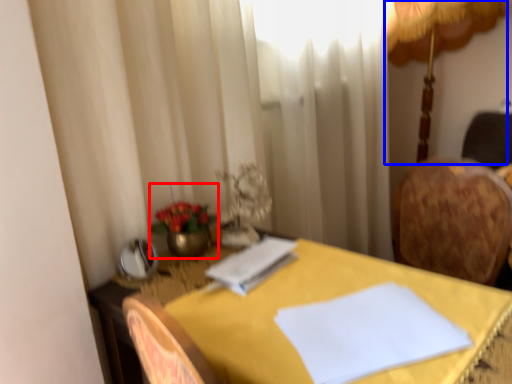
Question: Which point is further to the camera, floral arrangement (highlighted by a red box) or table lamp (highlighted by a blue box)?

Choices:
 (A) floral arrangement
 (B) table lamp

Answer: (B)